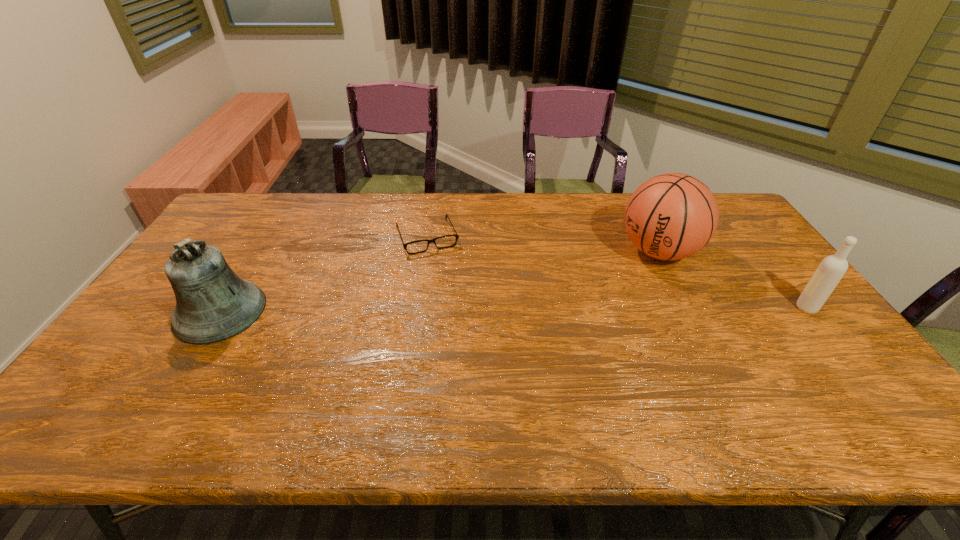
The image size is (960, 540). Find the location of `free space located 0.130m on the surface of the third object from left to right near the brand logo`. free space located 0.130m on the surface of the third object from left to right near the brand logo is located at coordinates (607, 285).

Identify the location of vacant area located 0.050m on the surface of the third object from left to right near the brand logo. The image size is (960, 540). (623, 274).

Where is `vacant space positioned 0.070m on the surface of the third object from left to right near the brand logo`? The image size is (960, 540). vacant space positioned 0.070m on the surface of the third object from left to right near the brand logo is located at coordinates [x=619, y=277].

Find the location of a particular element. spectacles that is at the far edge is located at coordinates point(456,235).

Image resolution: width=960 pixels, height=540 pixels. I want to click on basketball located at the far edge, so click(x=671, y=216).

You are a GUI agent. You are given a task and a screenshot of the screen. Output one action in this format:
    pyautogui.click(x=<x>, y=<y>)
    Task: Click on the object that is at the left edge
    
    Given the screenshot: What is the action you would take?
    pyautogui.click(x=213, y=304)

In order to click on object that is at the right edge in this screenshot , I will do `click(832, 268)`.

Where is `vacant area at the far edge of the desktop`? The width and height of the screenshot is (960, 540). vacant area at the far edge of the desktop is located at coordinates (570, 214).

Identify the location of free space at the near edge. Image resolution: width=960 pixels, height=540 pixels. (357, 375).

Where is `vacant region at the left edge of the desktop`? This screenshot has width=960, height=540. vacant region at the left edge of the desktop is located at coordinates (235, 242).